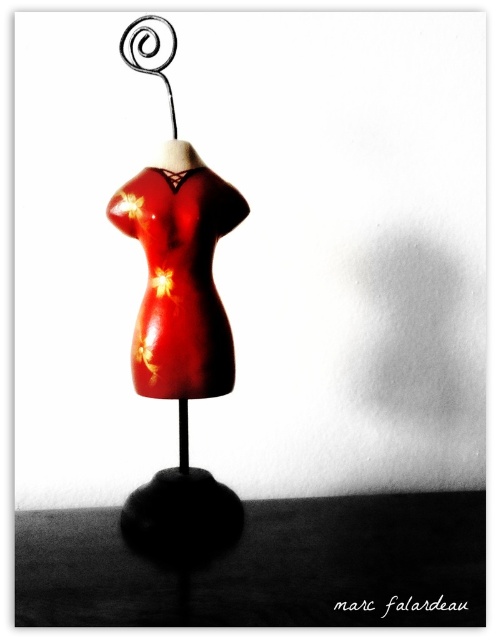
Image resolution: width=496 pixels, height=640 pixels. What do you see at coordinates (180, 280) in the screenshot?
I see `glossy red dress at center` at bounding box center [180, 280].

Which is in front, point (175, 173) or point (144, 60)?

Point (175, 173) is in front.

The width and height of the screenshot is (496, 640). What are the coordinates of `glossy red dress at center` in the screenshot? It's located at click(180, 280).